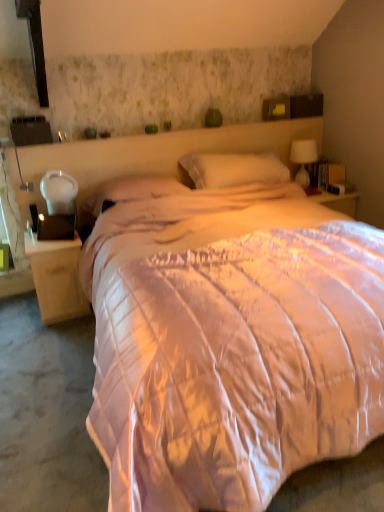
Identify the location of white glass table lamp at upper right. This screenshot has width=384, height=512. (303, 159).

What do you see at coordinates (57, 278) in the screenshot? I see `white matte nightstand at left` at bounding box center [57, 278].

Locate an element on the screen. white glass table lamp at upper right is located at coordinates (303, 159).

From the picture: Can you tell me how much white glass table lamp at upper right and white soft pillow at center, placed as the 2th pillow when sorted from left to right, differ in facing direction?

0.254 degrees.

In the image, is white glass table lamp at upper right positioned in front of or behind white soft pillow at center, which appears as the first pillow when viewed from the right?

white glass table lamp at upper right is positioned farther from the viewer than white soft pillow at center, which appears as the first pillow when viewed from the right.

Is the surface of white glass table lamp at upper right in direct contact with white soft pillow at center, placed as the 2th pillow when sorted from left to right?

No, white glass table lamp at upper right is not with white soft pillow at center, placed as the 2th pillow when sorted from left to right.

From the image's perspective, is white glass table lamp at upper right on white soft pillow at center, which appears as the first pillow when viewed from the right?

Yes, from the image's perspective, white glass table lamp at upper right is on top of white soft pillow at center, which appears as the first pillow when viewed from the right.

Based on their sizes in the image, would you say matte pink pillow at center, which is the 2th pillow in right-to-left order, is bigger or smaller than white glass table lamp at upper right?

matte pink pillow at center, which is the 2th pillow in right-to-left order, is bigger than white glass table lamp at upper right.

Consider the image. In terms of width, does matte pink pillow at center, which is the 2th pillow in right-to-left order, look wider or thinner when compared to white glass table lamp at upper right?

Considering their sizes, matte pink pillow at center, which is the 2th pillow in right-to-left order, looks broader than white glass table lamp at upper right.

Choose the correct answer: Is matte pink pillow at center, which is the 2th pillow in right-to-left order, inside white glass table lamp at upper right or outside it?

matte pink pillow at center, which is the 2th pillow in right-to-left order, is located beyond the bounds of white glass table lamp at upper right.

Are matte pink pillow at center, which is the first pillow from left to right, and white glass table lamp at upper right making contact?

matte pink pillow at center, which is the first pillow from left to right, and white glass table lamp at upper right are clearly separated.

Is white matte nightstand at left not inside white glass table lamp at upper right?

Yes, white matte nightstand at left is not within white glass table lamp at upper right.

Is white matte nightstand at left at the right side of white glass table lamp at upper right?

Incorrect, white matte nightstand at left is not on the right side of white glass table lamp at upper right.

Is white matte nightstand at left placed right next to white glass table lamp at upper right?

No.

Is white soft pillow at center, placed as the 2th pillow when sorted from left to right, oriented away from white glass table lamp at upper right?

No, white glass table lamp at upper right is not at the back of white soft pillow at center, placed as the 2th pillow when sorted from left to right.

Does white soft pillow at center, which appears as the first pillow when viewed from the right, lie in front of white glass table lamp at upper right?

Yes, it is in front of white glass table lamp at upper right.

Who is smaller, white soft pillow at center, placed as the 2th pillow when sorted from left to right, or white glass table lamp at upper right?

Smaller between the two is white glass table lamp at upper right.

Where is `table lamp below the white soft pillow at center, placed as the 2th pillow when sorted from left to right (from a real-world perspective)`? table lamp below the white soft pillow at center, placed as the 2th pillow when sorted from left to right (from a real-world perspective) is located at coordinates (303, 159).

I want to click on table lamp above the matte pink pillow at center, which is the first pillow from left to right (from a real-world perspective), so click(x=303, y=159).

From a real-world perspective, is white glass table lamp at upper right on top of matte pink pillow at center, which is the 2th pillow in right-to-left order?

Correct, in the physical world, white glass table lamp at upper right is higher than matte pink pillow at center, which is the 2th pillow in right-to-left order.

From the image's perspective, which one is positioned lower, white glass table lamp at upper right or matte pink pillow at center, which is the first pillow from left to right?

matte pink pillow at center, which is the first pillow from left to right, is shown below in the image.

From their relative heights in the image, would you say white glass table lamp at upper right is taller or shorter than matte pink pillow at center, which is the first pillow from left to right?

Considering their sizes, white glass table lamp at upper right has more height than matte pink pillow at center, which is the first pillow from left to right.

This screenshot has width=384, height=512. I want to click on nightstand located below the matte pink pillow at center, which is the first pillow from left to right (from the image's perspective), so click(x=57, y=278).

What's the angular difference between white matte nightstand at left and matte pink pillow at center, which is the first pillow from left to right,'s facing directions?

They differ by 0.79 degrees in their facing directions.

Consider the image. From the image's perspective, between white matte nightstand at left and matte pink pillow at center, which is the first pillow from left to right, which one is located above?

matte pink pillow at center, which is the first pillow from left to right, appears higher in the image.

From the image's perspective, between white soft pillow at center, placed as the 2th pillow when sorted from left to right, and white matte nightstand at left, which one is located above?

From the image's view, white soft pillow at center, placed as the 2th pillow when sorted from left to right, is above.

From a real-world perspective, is white soft pillow at center, which appears as the first pillow when viewed from the right, below white matte nightstand at left?

Incorrect, from a real-world perspective, white soft pillow at center, which appears as the first pillow when viewed from the right, is higher than white matte nightstand at left.

Does white soft pillow at center, which appears as the first pillow when viewed from the right, have a greater width compared to white matte nightstand at left?

Incorrect, the width of white soft pillow at center, which appears as the first pillow when viewed from the right, does not surpass that of white matte nightstand at left.

Identify the location of table lamp on the right of the white soft pillow at center, which appears as the first pillow when viewed from the right. (303, 159).

In the image, there is a white glass table lamp at upper right. Where is `pillow below it (from a real-world perspective)`? This screenshot has height=512, width=384. pillow below it (from a real-world perspective) is located at coordinates (130, 191).

Estimate the real-world distances between objects in this image. Which object is further from white soft pillow at center, which appears as the first pillow when viewed from the right, matte pink pillow at center, which is the first pillow from left to right, or white matte nightstand at left?

Based on the image, white matte nightstand at left appears to be further to white soft pillow at center, which appears as the first pillow when viewed from the right.

Which object lies further to the anchor point white glass table lamp at upper right, matte pink pillow at center, which is the 2th pillow in right-to-left order, or white soft pillow at center, placed as the 2th pillow when sorted from left to right?

Among the two, matte pink pillow at center, which is the 2th pillow in right-to-left order, is located further to white glass table lamp at upper right.

Estimate the real-world distances between objects in this image. Which object is further from white matte nightstand at left, white glass table lamp at upper right or white soft pillow at center, placed as the 2th pillow when sorted from left to right?

Based on the image, white glass table lamp at upper right appears to be further to white matte nightstand at left.

Consider the image. When comparing their distances from white soft pillow at center, which appears as the first pillow when viewed from the right, does white matte nightstand at left or white glass table lamp at upper right seem further?

The object further to white soft pillow at center, which appears as the first pillow when viewed from the right, is white matte nightstand at left.

Estimate the real-world distances between objects in this image. Which object is further from matte pink pillow at center, which is the 2th pillow in right-to-left order, white glass table lamp at upper right or white matte nightstand at left?

Based on the image, white glass table lamp at upper right appears to be further to matte pink pillow at center, which is the 2th pillow in right-to-left order.

Considering their positions, is matte pink pillow at center, which is the 2th pillow in right-to-left order, positioned further to white matte nightstand at left than white glass table lamp at upper right?

white glass table lamp at upper right is further to white matte nightstand at left.

Based on their spatial positions, is white soft pillow at center, which appears as the first pillow when viewed from the right, or white glass table lamp at upper right closer to matte pink pillow at center, which is the 2th pillow in right-to-left order?

Among the two, white soft pillow at center, which appears as the first pillow when viewed from the right, is located nearer to matte pink pillow at center, which is the 2th pillow in right-to-left order.

Based on their spatial positions, is white soft pillow at center, which appears as the first pillow when viewed from the right, or matte pink pillow at center, which is the first pillow from left to right, closer to white matte nightstand at left?

matte pink pillow at center, which is the first pillow from left to right, is closer to white matte nightstand at left.

Identify the location of pillow between matte pink pillow at center, which is the first pillow from left to right, and white glass table lamp at upper right from left to right. The width and height of the screenshot is (384, 512). (230, 170).

This screenshot has width=384, height=512. I want to click on pillow between white matte nightstand at left and white soft pillow at center, placed as the 2th pillow when sorted from left to right, in the horizontal direction, so click(130, 191).